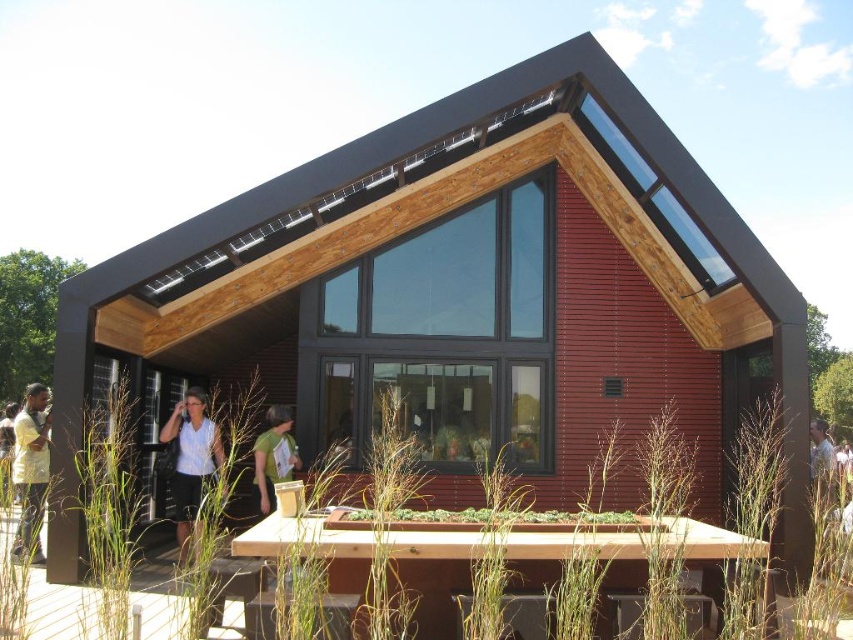
Question: Does matte white blouse at lower center have a larger size compared to light yellow shirt at left?

Choices:
 (A) yes
 (B) no

Answer: (B)

Question: Is matte white blouse at lower center positioned before green fabric shirt at center?

Choices:
 (A) no
 (B) yes

Answer: (B)

Question: Which object appears farthest from the camera in this image?

Choices:
 (A) light brown shirt at center
 (B) light yellow shirt at left
 (C) matte white blouse at lower center

Answer: (A)

Question: Which point appears closest to the camera in this image?

Choices:
 (A) (41, 412)
 (B) (817, 419)
 (C) (271, 484)

Answer: (A)

Question: Can you confirm if green fabric shirt at center is positioned to the right of light brown shirt at center?

Choices:
 (A) no
 (B) yes

Answer: (A)

Question: Which of these objects is positioned closest to the green fabric shirt at center?

Choices:
 (A) matte white blouse at lower center
 (B) light brown shirt at center

Answer: (A)